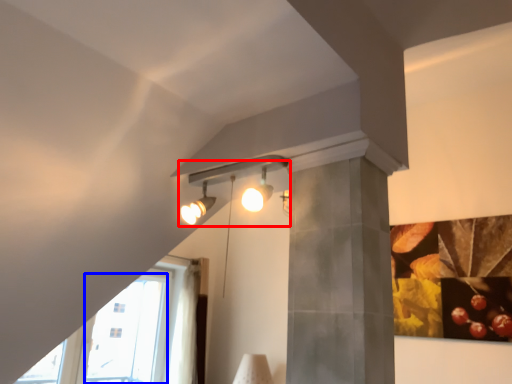
Question: Which object appears closest to the camera in this image, lamp (highlighted by a red box) or glass door (highlighted by a blue box)?

Choices:
 (A) lamp
 (B) glass door

Answer: (A)